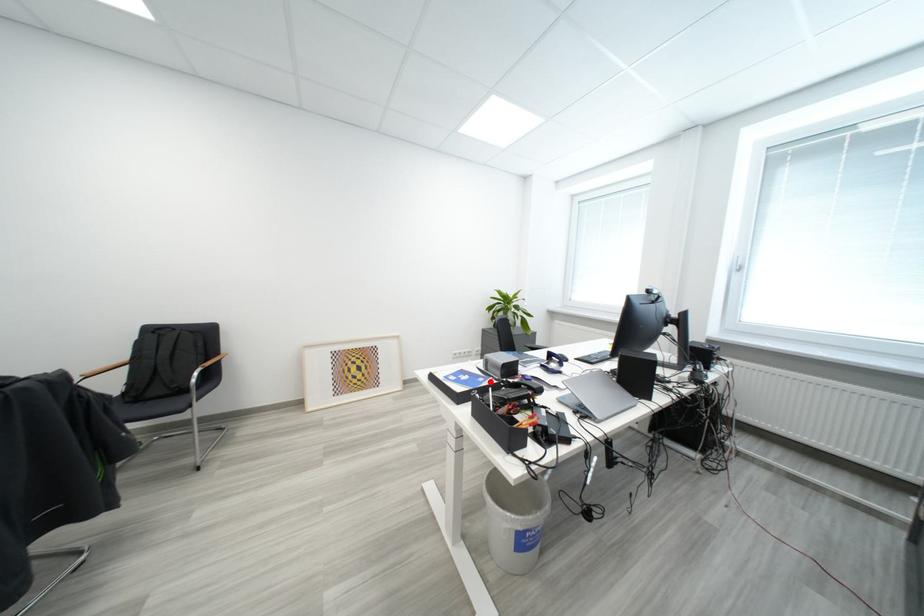
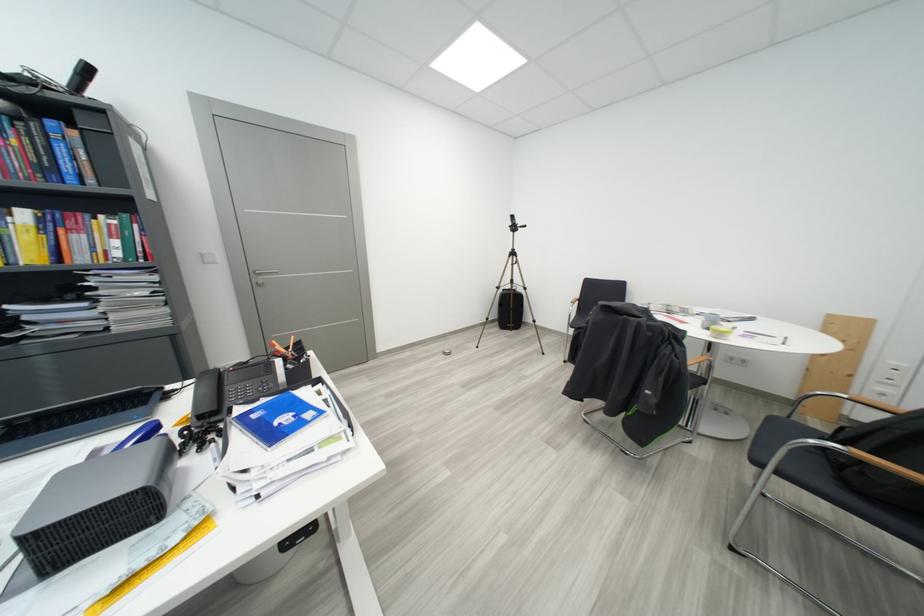
The point at the highlighted location is marked in the first image. Where is the corresponding point in the second image?

(263, 419)